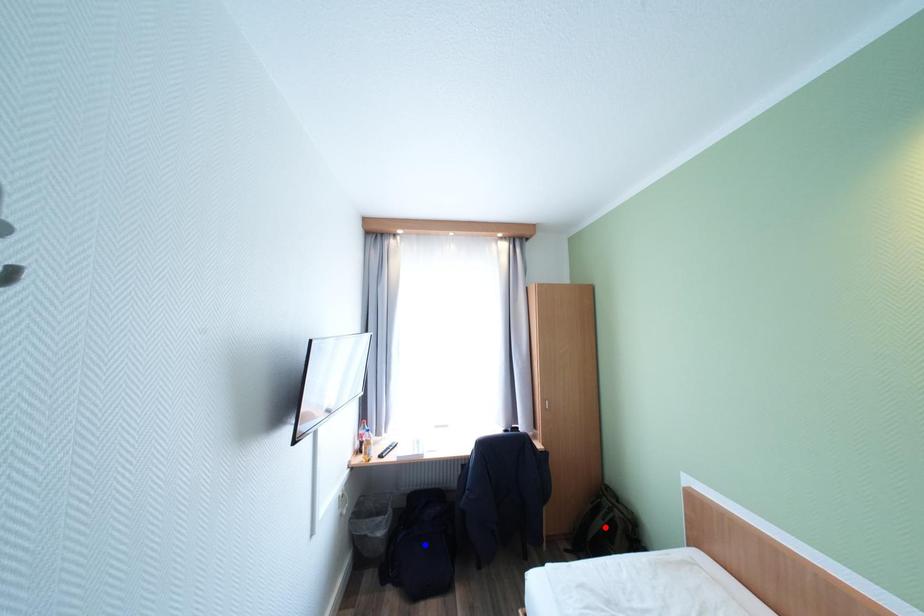
Question: In the image, two points are highlighted. Which point is nearer to the camera? Reply with the corresponding letter.

Choices:
 (A) blue point
 (B) red point

Answer: (B)